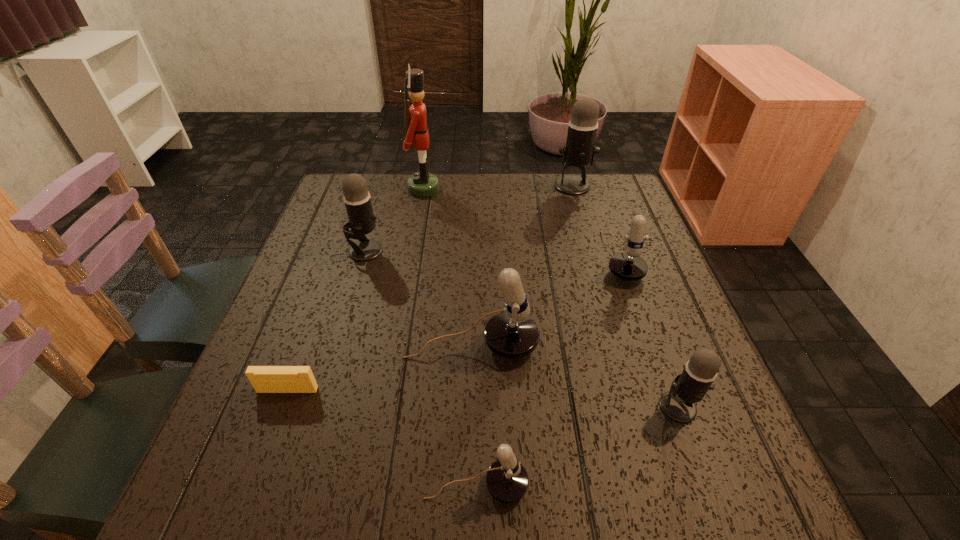
Find the location of a particular element. This screenshot has height=540, width=960. blank area at the far edge is located at coordinates (403, 180).

Find the location of `vacant space at the near edge of the desktop`. vacant space at the near edge of the desktop is located at coordinates (347, 467).

Identify the location of vacant space at the left edge of the desktop. The height and width of the screenshot is (540, 960). (347, 260).

Where is `free space at the right edge`? free space at the right edge is located at coordinates (650, 236).

Locate an element on the screen. free space between the smallest gray microphone and the second nearest white microphone is located at coordinates (575, 376).

Image resolution: width=960 pixels, height=540 pixels. Find the location of `vacant space that's between the farthest white microphone and the biggest white microphone`. vacant space that's between the farthest white microphone and the biggest white microphone is located at coordinates (545, 301).

At what (x,y) coordinates should I click in order to perform the action: click on unoccupied area between the second nearest microphone and the rightmost white microphone. Please return your answer as a coordinate pair (x, y). The image size is (960, 540). Looking at the image, I should click on (649, 332).

Where is `empty space that is in between the second farthest gray microphone and the beige videotape`? empty space that is in between the second farthest gray microphone and the beige videotape is located at coordinates (326, 320).

Identify the location of empty space between the seventh shortest object and the second nearest microphone. (626, 296).

Where is `free space between the beige videotape and the smallest white microphone`? Image resolution: width=960 pixels, height=540 pixels. free space between the beige videotape and the smallest white microphone is located at coordinates (382, 438).